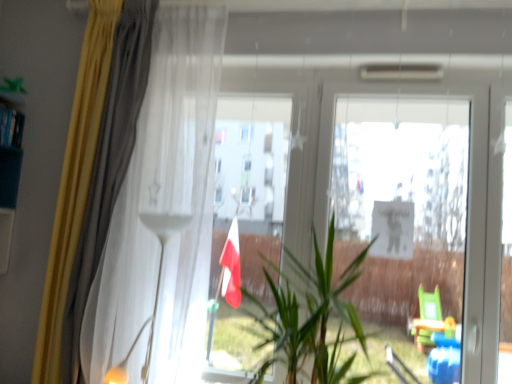
Describe the element at coordinates (309, 316) in the screenshot. I see `green leafy plant at center` at that location.

What do you see at coordinates (74, 183) in the screenshot?
I see `yellow fabric curtain at left, marked as the second curtain in a right-to-left arrangement` at bounding box center [74, 183].

What do you see at coordinates (155, 293) in the screenshot? The width and height of the screenshot is (512, 384). I see `white glossy floor lamp at upper center` at bounding box center [155, 293].

The image size is (512, 384). Describe the element at coordinates (162, 213) in the screenshot. I see `white sheer curtain at left, the first curtain viewed from the right` at that location.

Find the location of a particular element. The image size is (512, 384). green leafy plant at center is located at coordinates pos(309,316).

Can you confirm if yellow fabric curtain at left, marked as the second curtain in a right-to-left arrangement, is shorter than green leafy plant at center?

No.

From the image's perspective, which one is positioned higher, yellow fabric curtain at left, which is counted as the 1th curtain, starting from the left, or green leafy plant at center?

yellow fabric curtain at left, which is counted as the 1th curtain, starting from the left.

Can you tell me how much yellow fabric curtain at left, which is counted as the 1th curtain, starting from the left, and green leafy plant at center differ in facing direction?

There is a 2.81-degree angle between the facing directions of yellow fabric curtain at left, which is counted as the 1th curtain, starting from the left, and green leafy plant at center.

Considering the positions of point (45, 354) and point (335, 307), is point (45, 354) closer or farther from the camera than point (335, 307)?

Point (45, 354).

In terms of width, does green leafy plant at center look wider or thinner when compared to yellow fabric curtain at left, marked as the second curtain in a right-to-left arrangement?

green leafy plant at center is wider than yellow fabric curtain at left, marked as the second curtain in a right-to-left arrangement.

Consider the image. Would you say green leafy plant at center contains yellow fabric curtain at left, which is counted as the 1th curtain, starting from the left?

No.

Is green leafy plant at center positioned behind yellow fabric curtain at left, which is counted as the 1th curtain, starting from the left?

No, the depth of green leafy plant at center is less than that of yellow fabric curtain at left, which is counted as the 1th curtain, starting from the left.

Looking at this image, which of these two, green leafy plant at center or yellow fabric curtain at left, marked as the second curtain in a right-to-left arrangement, is smaller?

With smaller size is yellow fabric curtain at left, marked as the second curtain in a right-to-left arrangement.

Which is correct: white sheer curtain at left, acting as the second curtain starting from the left, is inside green leafy plant at center, or outside of it?

white sheer curtain at left, acting as the second curtain starting from the left, exists outside the volume of green leafy plant at center.

Would you consider white sheer curtain at left, the first curtain viewed from the right, to be distant from green leafy plant at center?

No, there isn't a large distance between white sheer curtain at left, the first curtain viewed from the right, and green leafy plant at center.

Considering the positions of point (129, 178) and point (298, 331), is point (129, 178) closer or farther from the camera than point (298, 331)?

Point (129, 178) is farther from the camera than point (298, 331).

Does white sheer curtain at left, acting as the second curtain starting from the left, lie in front of green leafy plant at center?

No, the depth of white sheer curtain at left, acting as the second curtain starting from the left, is greater than that of green leafy plant at center.

In terms of size, does green leafy plant at center appear bigger or smaller than white glossy floor lamp at upper center?

green leafy plant at center is bigger than white glossy floor lamp at upper center.

Is green leafy plant at center with white glossy floor lamp at upper center?

No, green leafy plant at center is not in contact with white glossy floor lamp at upper center.

Can you confirm if green leafy plant at center is wider than white glossy floor lamp at upper center?

Yes.

From a real-world perspective, is green leafy plant at center positioned over white glossy floor lamp at upper center based on gravity?

Correct, in the physical world, green leafy plant at center is higher than white glossy floor lamp at upper center.

Would you consider transparent glass screen door at right to be distant from white sheer curtain at left, acting as the second curtain starting from the left?

transparent glass screen door at right is actually quite close to white sheer curtain at left, acting as the second curtain starting from the left.

Which of these two, transparent glass screen door at right or white sheer curtain at left, acting as the second curtain starting from the left, is bigger?

Bigger between the two is white sheer curtain at left, acting as the second curtain starting from the left.

How much distance is there between transparent glass screen door at right and white sheer curtain at left, acting as the second curtain starting from the left?

transparent glass screen door at right and white sheer curtain at left, acting as the second curtain starting from the left, are 38.84 inches apart from each other.

Which is in front, point (409, 114) or point (106, 367)?

Positioned in front is point (106, 367).

Between point (170, 224) and point (88, 96), which one is positioned in front?

Point (170, 224)

Which is behind, white glossy floor lamp at upper center or yellow fabric curtain at left, which is counted as the 1th curtain, starting from the left?

yellow fabric curtain at left, which is counted as the 1th curtain, starting from the left, is further from the camera.

Considering the relative sizes of white glossy floor lamp at upper center and yellow fabric curtain at left, which is counted as the 1th curtain, starting from the left, in the image provided, is white glossy floor lamp at upper center shorter than yellow fabric curtain at left, which is counted as the 1th curtain, starting from the left,?

Correct, white glossy floor lamp at upper center is not as tall as yellow fabric curtain at left, which is counted as the 1th curtain, starting from the left.

Is white glossy floor lamp at upper center looking in the opposite direction of yellow fabric curtain at left, which is counted as the 1th curtain, starting from the left?

No, white glossy floor lamp at upper center's orientation is not away from yellow fabric curtain at left, which is counted as the 1th curtain, starting from the left.

From the image's perspective, is white glossy floor lamp at upper center beneath green leafy plant at center?

Correct, white glossy floor lamp at upper center appears lower than green leafy plant at center in the image.

Is white glossy floor lamp at upper center closer to the viewer compared to green leafy plant at center?

No, the depth of white glossy floor lamp at upper center is greater than that of green leafy plant at center.

Could you tell me if white glossy floor lamp at upper center is turned towards green leafy plant at center?

No, white glossy floor lamp at upper center does not turn towards green leafy plant at center.

What's the angular difference between white glossy floor lamp at upper center and green leafy plant at center's facing directions?

The angular difference between white glossy floor lamp at upper center and green leafy plant at center is 3.54 degrees.

You are a GUI agent. You are given a task and a screenshot of the screen. Output one action in this format:
    pyautogui.click(x=<x>, y=<y>)
    Task: Click on the houseplant located on the right of yellow fabric curtain at left, marked as the second curtain in a right-to-left arrangement
    
    Given the screenshot: What is the action you would take?
    pyautogui.click(x=309, y=316)

This screenshot has height=384, width=512. I want to click on the 1st curtain positioned above the green leafy plant at center (from a real-world perspective), so click(74, 183).

Estimate the real-world distances between objects in this image. Which object is further from yellow fabric curtain at left, which is counted as the 1th curtain, starting from the left, transparent glass screen door at right or white glossy floor lamp at upper center?

The object further to yellow fabric curtain at left, which is counted as the 1th curtain, starting from the left, is transparent glass screen door at right.

When comparing their distances from transparent glass screen door at right, does green leafy plant at center or white glossy floor lamp at upper center seem closer?

green leafy plant at center is closer to transparent glass screen door at right.

From the image, which object appears to be farther from yellow fabric curtain at left, which is counted as the 1th curtain, starting from the left, green leafy plant at center or white glossy floor lamp at upper center?

green leafy plant at center.

When comparing their distances from white sheer curtain at left, acting as the second curtain starting from the left, does green leafy plant at center or yellow fabric curtain at left, which is counted as the 1th curtain, starting from the left, seem further?

The object further to white sheer curtain at left, acting as the second curtain starting from the left, is green leafy plant at center.

Which object lies nearer to the anchor point yellow fabric curtain at left, marked as the second curtain in a right-to-left arrangement, white sheer curtain at left, acting as the second curtain starting from the left, or white glossy floor lamp at upper center?

white sheer curtain at left, acting as the second curtain starting from the left, lies closer to yellow fabric curtain at left, marked as the second curtain in a right-to-left arrangement, than the other object.

Estimate the real-world distances between objects in this image. Which object is closer to yellow fabric curtain at left, marked as the second curtain in a right-to-left arrangement, green leafy plant at center or white sheer curtain at left, acting as the second curtain starting from the left?

white sheer curtain at left, acting as the second curtain starting from the left, is positioned closer to the anchor yellow fabric curtain at left, marked as the second curtain in a right-to-left arrangement.

Estimate the real-world distances between objects in this image. Which object is closer to white glossy floor lamp at upper center, yellow fabric curtain at left, which is counted as the 1th curtain, starting from the left, or green leafy plant at center?

yellow fabric curtain at left, which is counted as the 1th curtain, starting from the left, is positioned closer to the anchor white glossy floor lamp at upper center.

Estimate the real-world distances between objects in this image. Which object is closer to white sheer curtain at left, acting as the second curtain starting from the left, yellow fabric curtain at left, marked as the second curtain in a right-to-left arrangement, or green leafy plant at center?

yellow fabric curtain at left, marked as the second curtain in a right-to-left arrangement, is positioned closer to the anchor white sheer curtain at left, acting as the second curtain starting from the left.

Image resolution: width=512 pixels, height=384 pixels. What are the coordinates of `curtain between yellow fabric curtain at left, which is counted as the 1th curtain, starting from the left, and green leafy plant at center, in the horizontal direction` in the screenshot? It's located at (162, 213).

At what (x,y) coordinates should I click in order to perform the action: click on lamp between yellow fabric curtain at left, marked as the second curtain in a right-to-left arrangement, and green leafy plant at center. Please return your answer as a coordinate pair (x, y). Image resolution: width=512 pixels, height=384 pixels. Looking at the image, I should click on (155, 293).

Where is `curtain between yellow fabric curtain at left, marked as the second curtain in a right-to-left arrangement, and white glossy floor lamp at upper center, in the vertical direction`? The image size is (512, 384). curtain between yellow fabric curtain at left, marked as the second curtain in a right-to-left arrangement, and white glossy floor lamp at upper center, in the vertical direction is located at coordinates (162, 213).

The height and width of the screenshot is (384, 512). I want to click on curtain between yellow fabric curtain at left, which is counted as the 1th curtain, starting from the left, and transparent glass screen door at right, in the horizontal direction, so click(x=162, y=213).